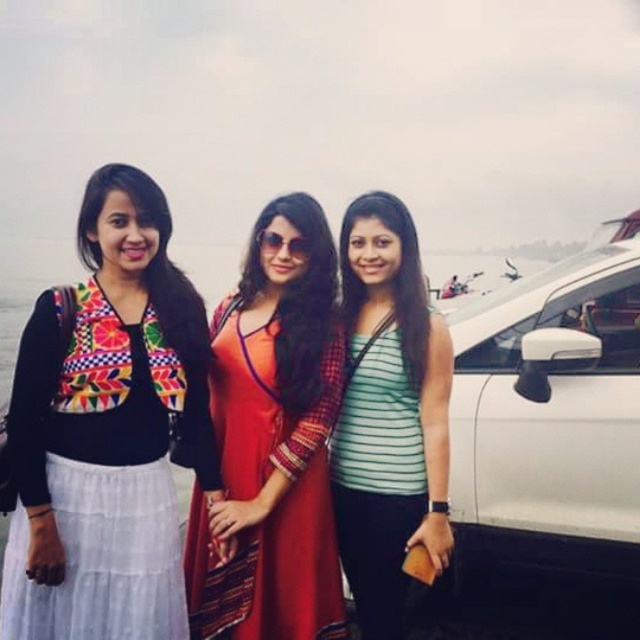
You are trying to locate the green striped tank top at center in the image. According to the coordinates given, where would you look to find it?

The green striped tank top at center is located at point (388, 413).

You are taking a photo of the three people in the scene. The camera has a focus point at coordinates 0.648, 0.608. Which person should you aim the camera at to capture the green striped tank top at center clearly?

The green striped tank top at center is located at point (388, 413), so you should aim the camera at the person wearing the green striped tank top at center to capture it clearly.

You are standing at the point marked by coordinates point (552, 436) in the image. What object is located at that point?

The point (552, 436) marks the white glossy car at right.